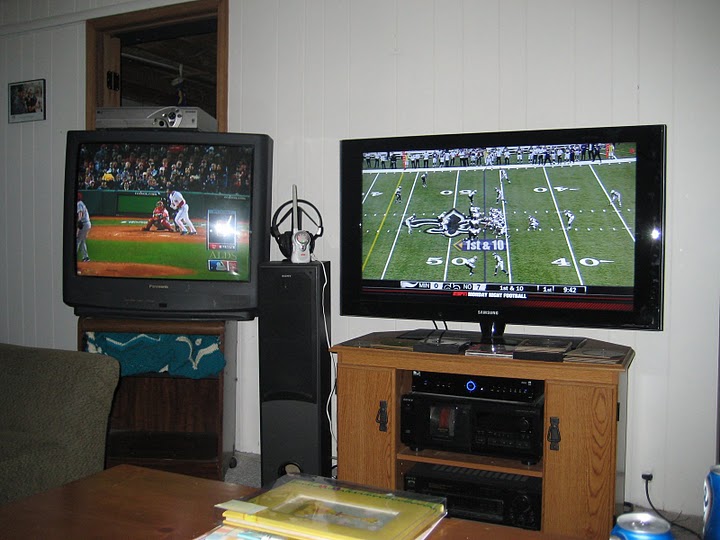
This screenshot has width=720, height=540. In order to click on flat screen tv in this screenshot , I will do `click(543, 237)`.